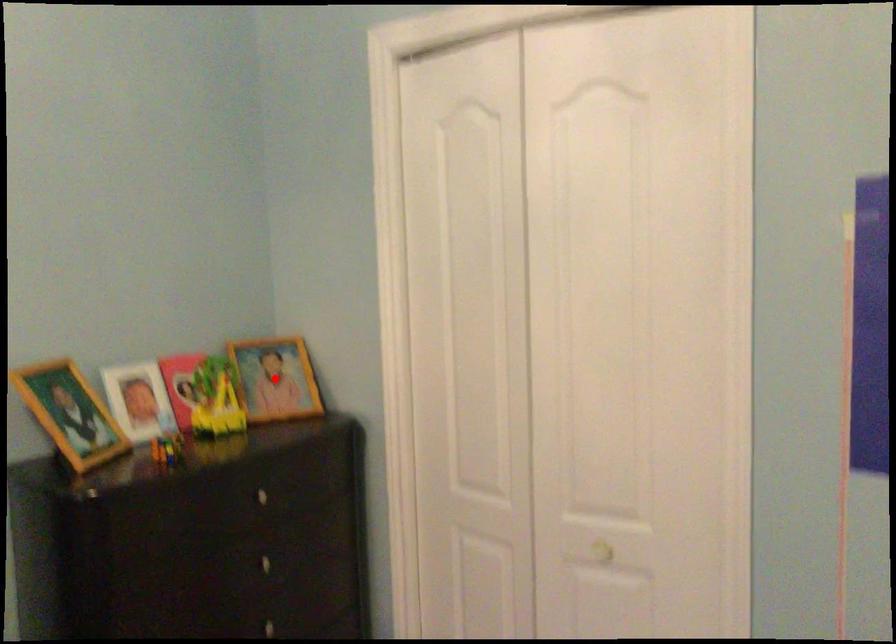
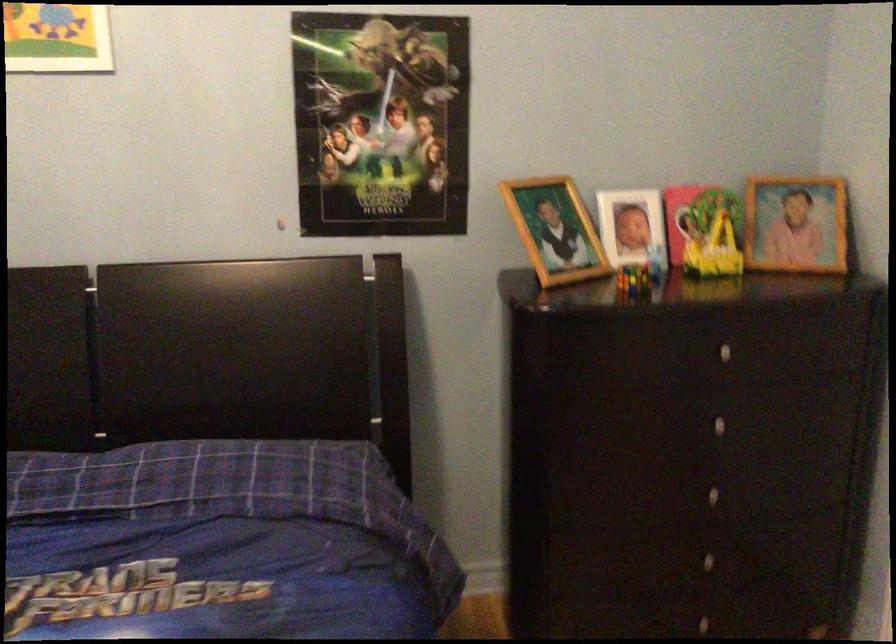
Question: I am providing you with two images of the same scene from different viewpoints. Image1 has a red point marked. In image2, the corresponding 3D location appears at what relative position? Reply with the corresponding letter.

Choices:
 (A) Closer
 (B) Farther

Answer: (A)